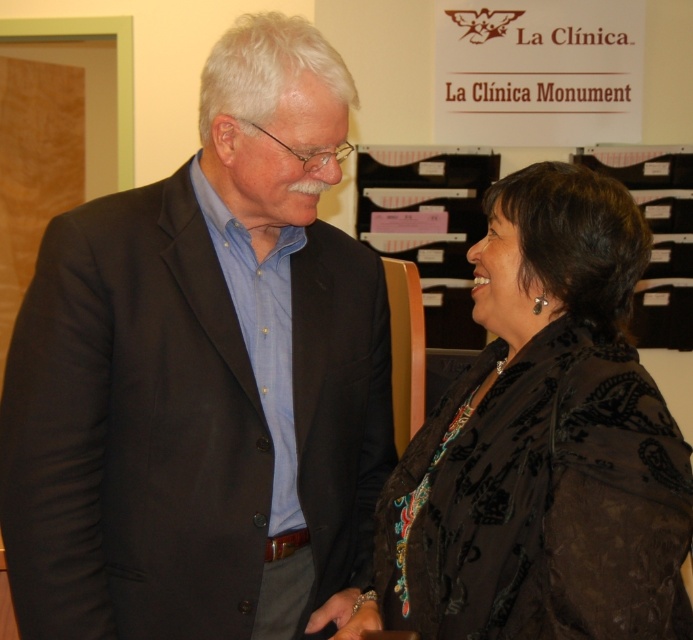
Between point (159, 352) and point (471, 588), which one is positioned in front?

Point (471, 588)

Which is more to the left, matte black suit at center or black velvet jacket at center?

matte black suit at center

Is point (78, 557) more distant than point (581, 561)?

Yes.

Find the location of a particular element. matte black suit at center is located at coordinates (204, 378).